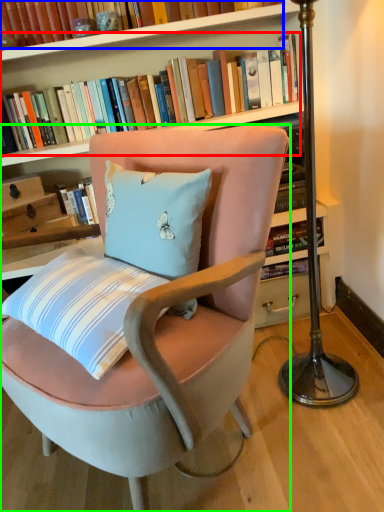
Question: Which object is the farthest from book (highlighted by a red box)? Choose among these: book (highlighted by a blue box) or chair (highlighted by a green box).

Choices:
 (A) book
 (B) chair

Answer: (B)